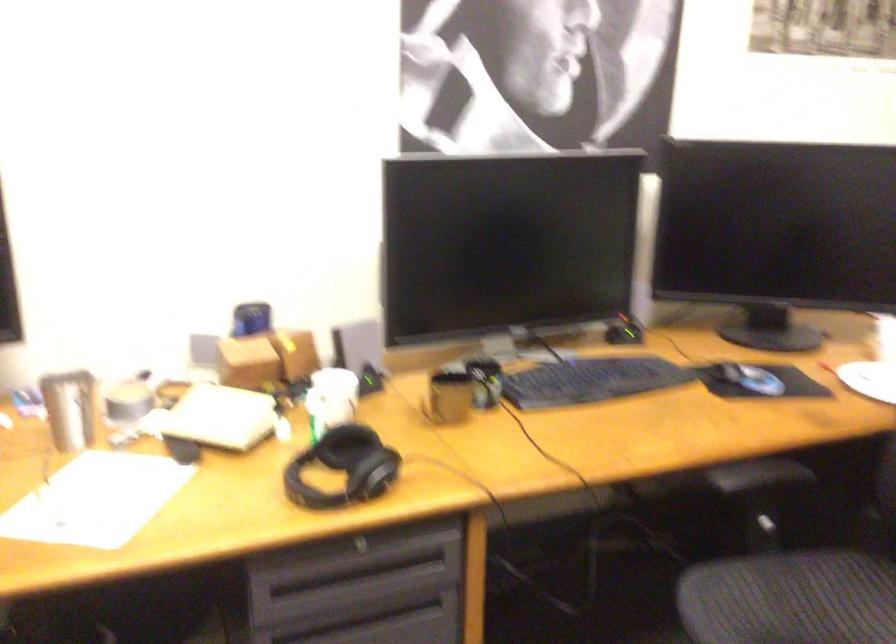
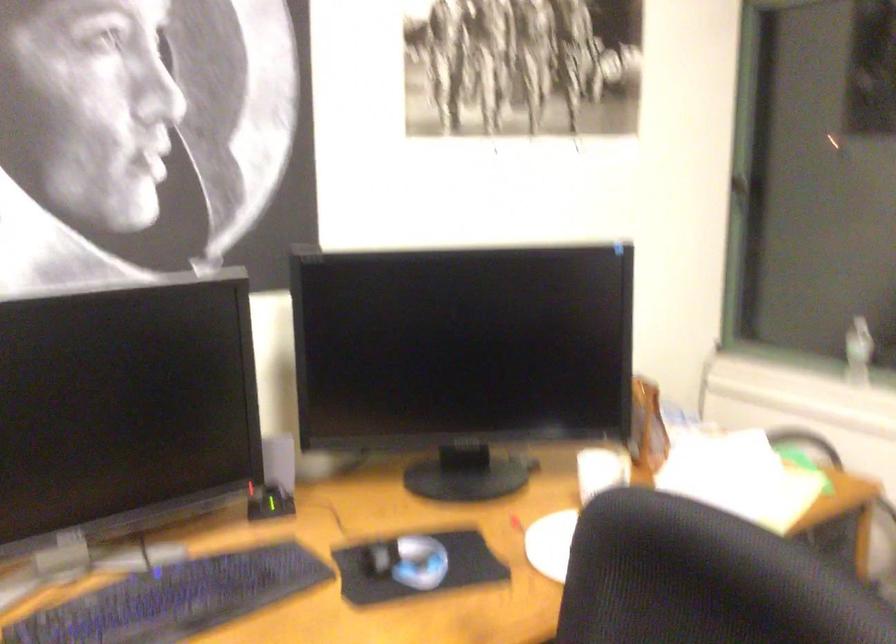
Find the pixel in the second image that matches point 730,364 in the first image.

(380, 558)